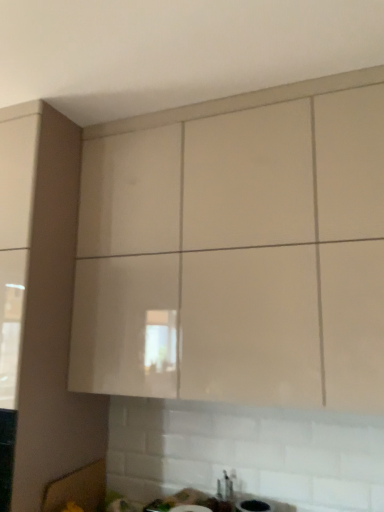
Question: Is point (337, 186) positioned closer to the camera than point (226, 488)?

Choices:
 (A) farther
 (B) closer

Answer: (B)

Question: Considering the positions of matte beige cabinet at upper center and white glossy sink at lower center in the image, is matte beige cabinet at upper center wider or thinner than white glossy sink at lower center?

Choices:
 (A) thin
 (B) wide

Answer: (B)

Question: From the image's perspective, relative to white glossy sink at lower center, is matte beige cabinet at upper center above or below?

Choices:
 (A) below
 (B) above

Answer: (B)

Question: From the image's perspective, is white glossy sink at lower center positioned above or below matte beige cabinet at upper center?

Choices:
 (A) above
 (B) below

Answer: (B)

Question: Is white glossy sink at lower center wider or thinner than matte beige cabinet at upper center?

Choices:
 (A) thin
 (B) wide

Answer: (A)

Question: Is white glossy sink at lower center in front of or behind matte beige cabinet at upper center in the image?

Choices:
 (A) front
 (B) behind

Answer: (B)

Question: Looking at the image, does white glossy sink at lower center seem bigger or smaller compared to matte beige cabinet at upper center?

Choices:
 (A) small
 (B) big

Answer: (A)